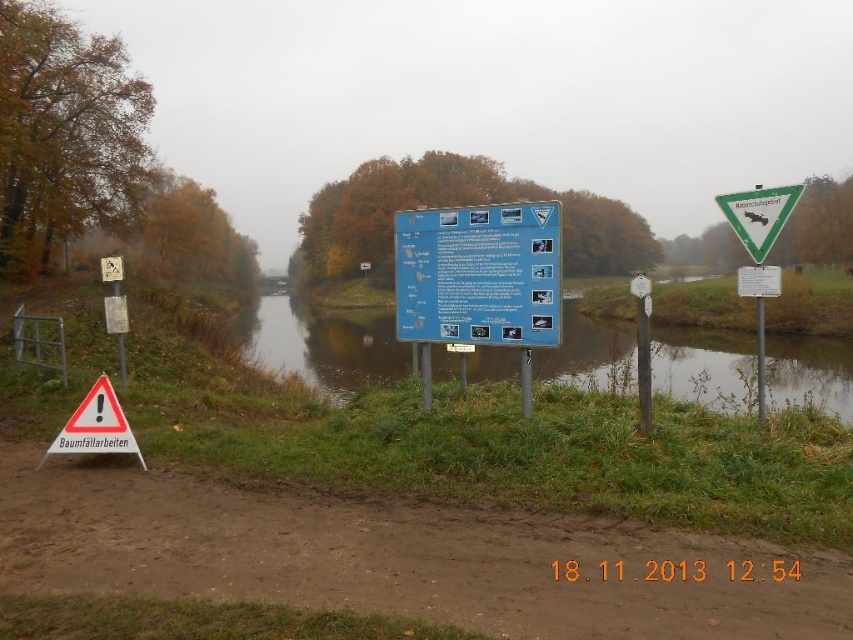
Question: Can you confirm if greenish reflective water at center is positioned to the right of green plastic sign at upper right?

Choices:
 (A) no
 (B) yes

Answer: (A)

Question: Which object is farther from the camera taking this photo?

Choices:
 (A) greenish reflective water at center
 (B) red reflective triangle at lower left
 (C) green plastic sign at upper right
 (D) blue plastic sign at center

Answer: (D)

Question: Which of these objects is positioned farthest from the greenish reflective water at center?

Choices:
 (A) red reflective triangle at lower left
 (B) blue plastic sign at center

Answer: (B)

Question: Does greenish reflective water at center have a smaller size compared to red reflective triangle at lower left?

Choices:
 (A) yes
 (B) no

Answer: (B)

Question: Is greenish reflective water at center positioned behind blue plastic sign at center?

Choices:
 (A) yes
 (B) no

Answer: (B)

Question: Among these objects, which one is farthest from the camera?

Choices:
 (A) greenish reflective water at center
 (B) red reflective triangle at lower left
 (C) green plastic sign at upper right

Answer: (A)